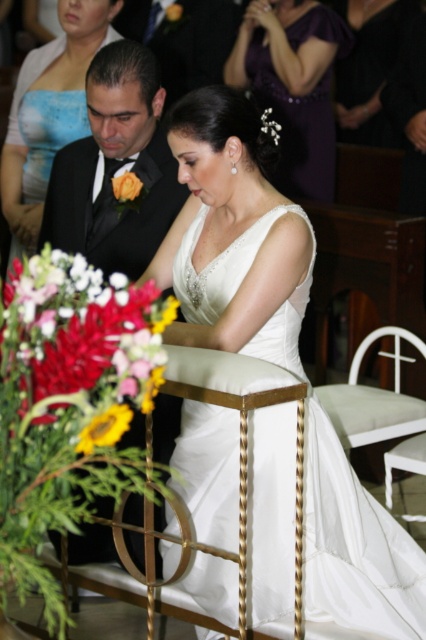
Describe the element at coordinates (293, 84) in the screenshot. Image resolution: width=426 pixels, height=640 pixels. I see `satin purple dress at upper center` at that location.

The height and width of the screenshot is (640, 426). Describe the element at coordinates (293, 84) in the screenshot. I see `satin purple dress at upper center` at that location.

The height and width of the screenshot is (640, 426). In order to click on satin purple dress at upper center in this screenshot , I will do `click(293, 84)`.

Can you confirm if vibrant floral bouquet at lower left is positioned to the left of matte gold boutonniere at upper left?

Yes, vibrant floral bouquet at lower left is to the left of matte gold boutonniere at upper left.

Who is positioned more to the right, vibrant floral bouquet at lower left or matte gold boutonniere at upper left?

matte gold boutonniere at upper left is more to the right.

Is point (163, 326) farther from viewer compared to point (115, 177)?

No, (163, 326) is in front of (115, 177).

At what (x,y) coordinates should I click in order to perform the action: click on vibrant floral bouquet at lower left. Please return your answer as a coordinate pair (x, y). The height and width of the screenshot is (640, 426). Looking at the image, I should click on (80, 344).

Does black satin tuxedo at center have a larger size compared to matte gold boutonniere at upper left?

Yes.

Does point (62, 150) come behind point (121, 196)?

Yes.

Image resolution: width=426 pixels, height=640 pixels. In order to click on black satin tuxedo at center in this screenshot , I will do `click(115, 166)`.